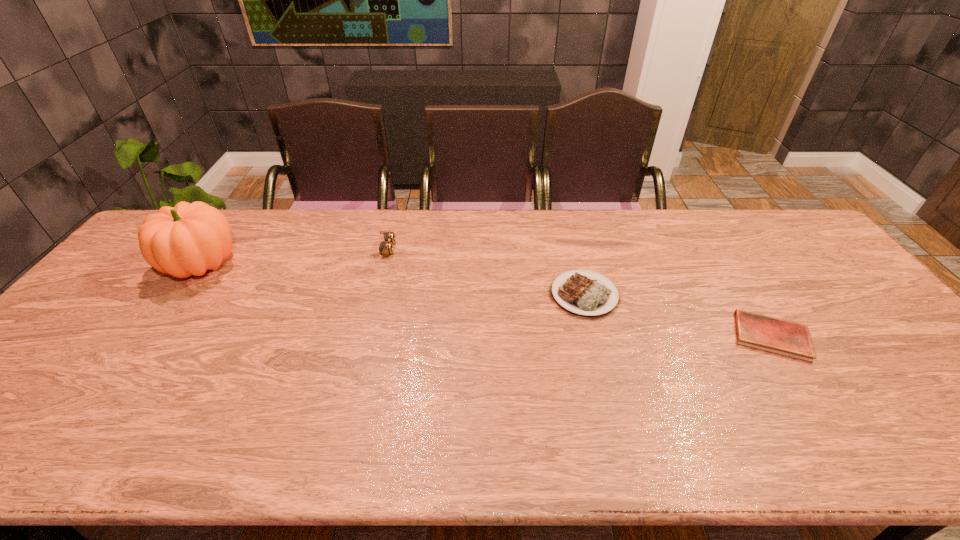
Locate an element on the screen. This screenshot has height=540, width=960. vacant space situated on the front of the second shortest object is located at coordinates (613, 410).

Image resolution: width=960 pixels, height=540 pixels. I want to click on free space located on the right of the shortest object, so click(895, 336).

At what (x,y) coordinates should I click in order to perform the action: click on pumpkin that is at the far edge. Please return your answer as a coordinate pair (x, y). Looking at the image, I should click on (188, 239).

Locate an element on the screen. This screenshot has height=540, width=960. goggles at the far edge is located at coordinates (385, 248).

Locate an element on the screen. The height and width of the screenshot is (540, 960). object that is at the left edge is located at coordinates (188, 239).

This screenshot has width=960, height=540. I want to click on object located in the far left corner section of the desktop, so click(188, 239).

This screenshot has height=540, width=960. Identify the location of free location at the far edge of the desktop. (542, 233).

This screenshot has height=540, width=960. In the image, there is a desktop. In order to click on free space at the near edge in this screenshot , I will do `click(765, 460)`.

The image size is (960, 540). I want to click on vacant area at the right edge, so 900,352.

What are the coordinates of `free space at the far right corner of the desktop` in the screenshot? It's located at (765, 217).